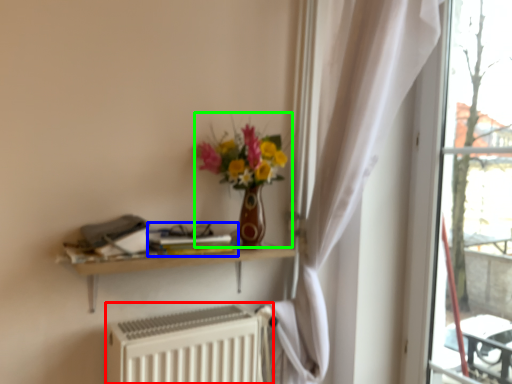
Question: Which object is positioned farthest from radiator (highlighted by a red box)? Select from book (highlighted by a blue box) and floral arrangement (highlighted by a green box).

Choices:
 (A) book
 (B) floral arrangement

Answer: (B)